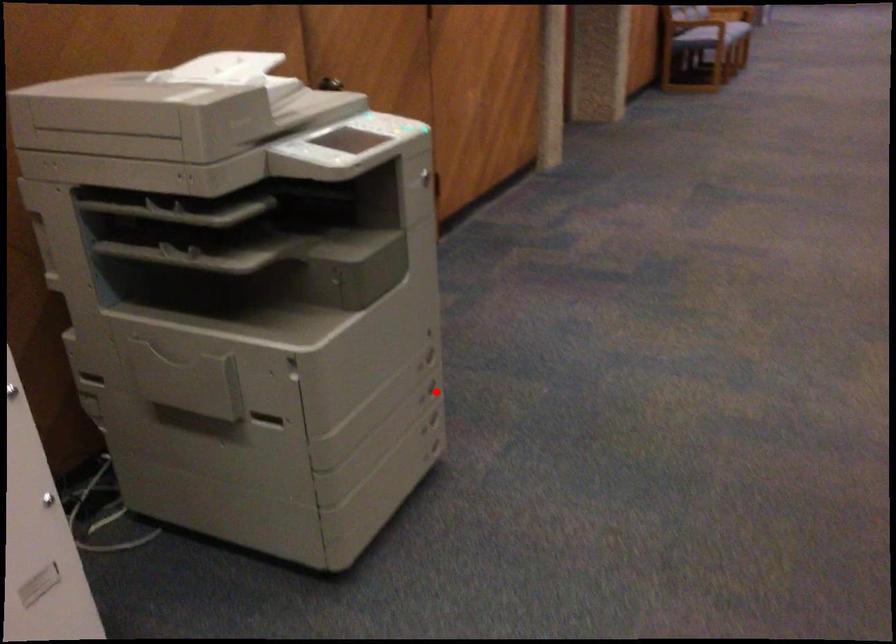
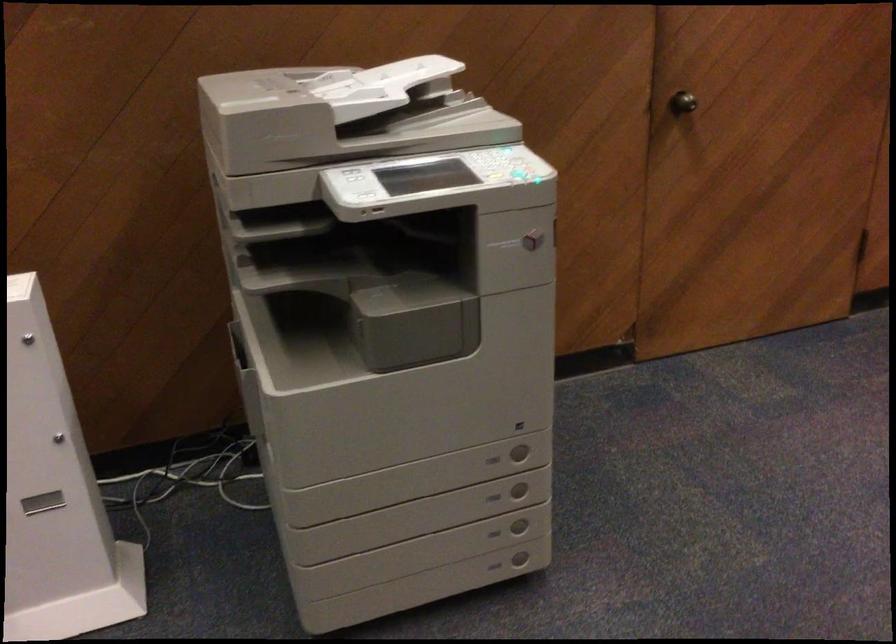
The point at the highlighted location is marked in the first image. Where is the corresponding point in the second image?

(519, 489)